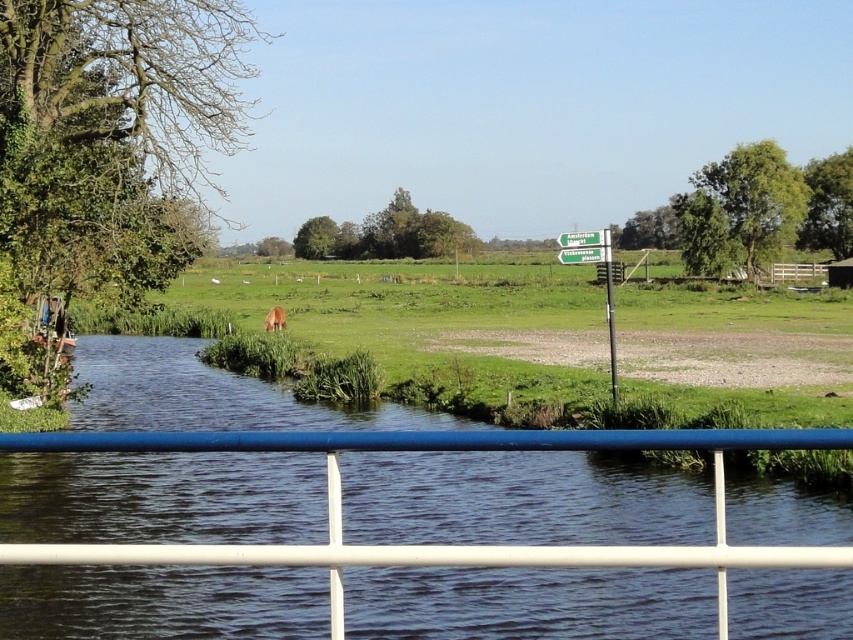
You are standing on the bridge looking at the two points marked in the image. Which point is closer to you, point (608, 250) or point (276, 310)?

Point (608, 250) is in front of point (276, 310), so it is closer to you.

You are standing on the bridge looking at the green plastic sign at upper center. If you walk straight ahead, will you eventually reach the brown animal near the water? Please explain why or why not based on the scene description.

The green plastic sign at upper center is located at point (581, 237), which is in the upper part of the frame. Since you are on the bridge looking towards the sign, walking straight ahead would take you towards the middle and background areas of the scene. The brown animal is near the water edge in the foreground. Therefore, walking straight ahead from the bridge would not lead you directly to the brown animal, as it is positioned in a different area of the scene.

You are a hiker who wants to read the green plastic sign at center and the green plastic sign at upper center. Which one is located to the left of the other?

The green plastic sign at center is positioned on the left side of green plastic sign at upper center.